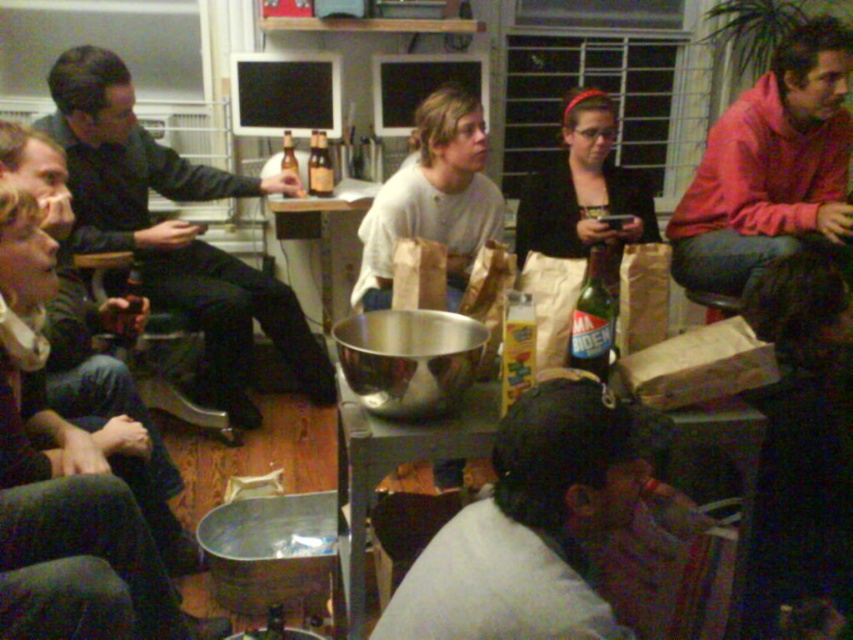
Question: Can you confirm if green glass bottle at center is positioned to the right of translucent glass bottles at center?

Choices:
 (A) no
 (B) yes

Answer: (B)

Question: Which point is farther to the camera?

Choices:
 (A) (569, 344)
 (B) (247, 396)

Answer: (B)

Question: Which is nearer to the red fleece jacket at right?

Choices:
 (A) translucent glass bottles at center
 (B) green glass bottle at center
 (C) dark gray fabric at lower center
 (D) matte black shirt at left

Answer: (A)

Question: Can you confirm if matte black shirt at left is positioned to the right of red fleece jacket at right?

Choices:
 (A) no
 (B) yes

Answer: (A)

Question: Which of the following is the farthest from the observer?

Choices:
 (A) green glass bottle at center
 (B) red fleece jacket at right
 (C) dark gray fabric at lower center

Answer: (B)

Question: Is green glass bottle at center to the left of translucent glass bottles at center from the viewer's perspective?

Choices:
 (A) no
 (B) yes

Answer: (A)